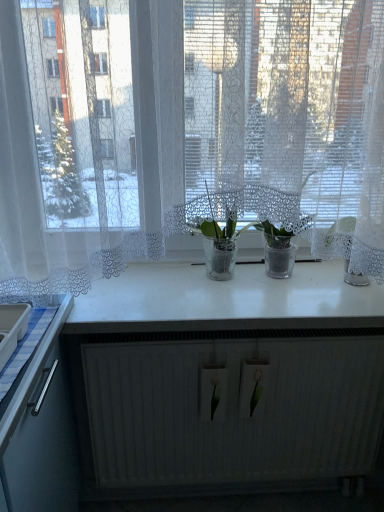
Question: Is translucent glass vase at center completely or partially outside of white glossy counter top at center?

Choices:
 (A) yes
 (B) no

Answer: (A)

Question: From the image's perspective, is translucent glass vase at center over white glossy counter top at center?

Choices:
 (A) yes
 (B) no

Answer: (A)

Question: Does translucent glass vase at center come behind white glossy counter top at center?

Choices:
 (A) yes
 (B) no

Answer: (A)

Question: Could you tell me if translucent glass vase at center is facing white glossy counter top at center?

Choices:
 (A) yes
 (B) no

Answer: (B)

Question: From the image's perspective, would you say translucent glass vase at center is shown under white glossy counter top at center?

Choices:
 (A) no
 (B) yes

Answer: (A)

Question: From a real-world perspective, is translucent glass vase at center physically below white glossy counter top at center?

Choices:
 (A) no
 (B) yes

Answer: (A)

Question: Can you confirm if transparent glass plants at center is positioned to the left of white matte radiator at lower center?

Choices:
 (A) yes
 (B) no

Answer: (A)

Question: Is transparent glass plants at center facing towards white matte radiator at lower center?

Choices:
 (A) no
 (B) yes

Answer: (A)

Question: Is white matte radiator at lower center at the back of transparent glass plants at center?

Choices:
 (A) no
 (B) yes

Answer: (A)

Question: Does transparent glass plants at center appear on the right side of white matte radiator at lower center?

Choices:
 (A) yes
 (B) no

Answer: (B)

Question: Does transparent glass plants at center have a greater width compared to white matte radiator at lower center?

Choices:
 (A) yes
 (B) no

Answer: (A)

Question: Can you confirm if transparent glass plants at center is smaller than white matte radiator at lower center?

Choices:
 (A) no
 (B) yes

Answer: (A)

Question: From the image's perspective, does white glossy counter top at center appear lower than transparent glass plants at center?

Choices:
 (A) no
 (B) yes

Answer: (B)